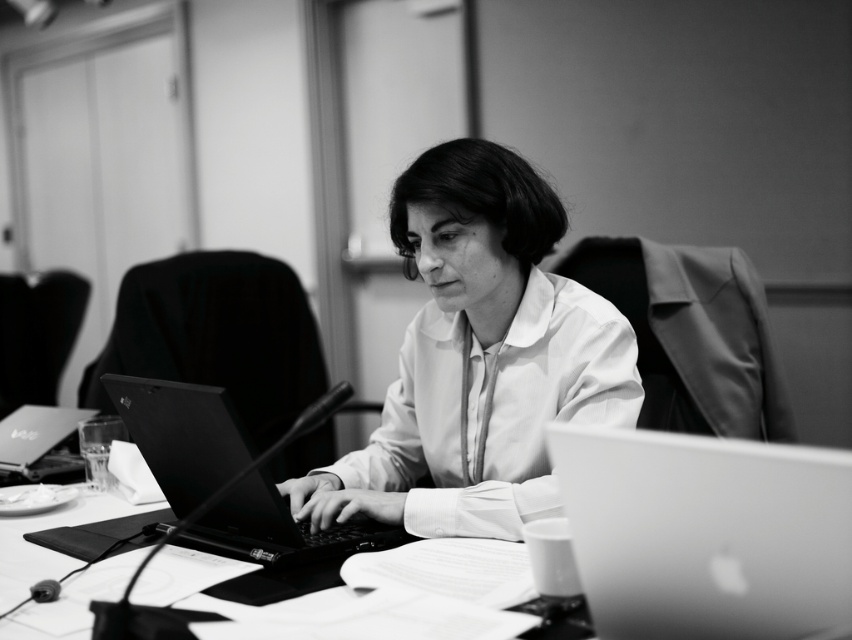
You are a photographer trying to capture a closeup of the white smooth shirt at center and the matte black laptop at left. Given that your camera can only focus on objects within a 10 cm height difference, will you need to adjust the camera angle?

The white smooth shirt at center is much taller than the matte black laptop at left, so the height difference between them might exceed 10 cm. You may need to adjust the camera angle to ensure both are in focus.